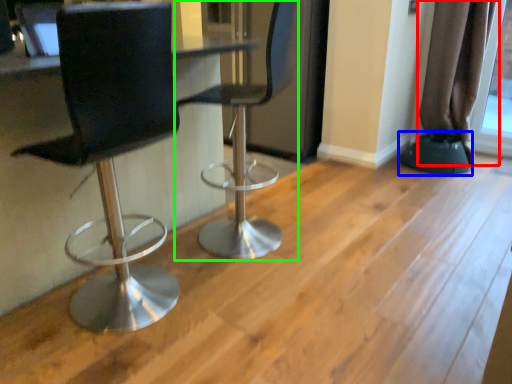
Question: Considering the real-world distances, which object is farthest from curtain (highlighted by a red box)? step stool (highlighted by a blue box) or chair (highlighted by a green box)?

Choices:
 (A) step stool
 (B) chair

Answer: (B)